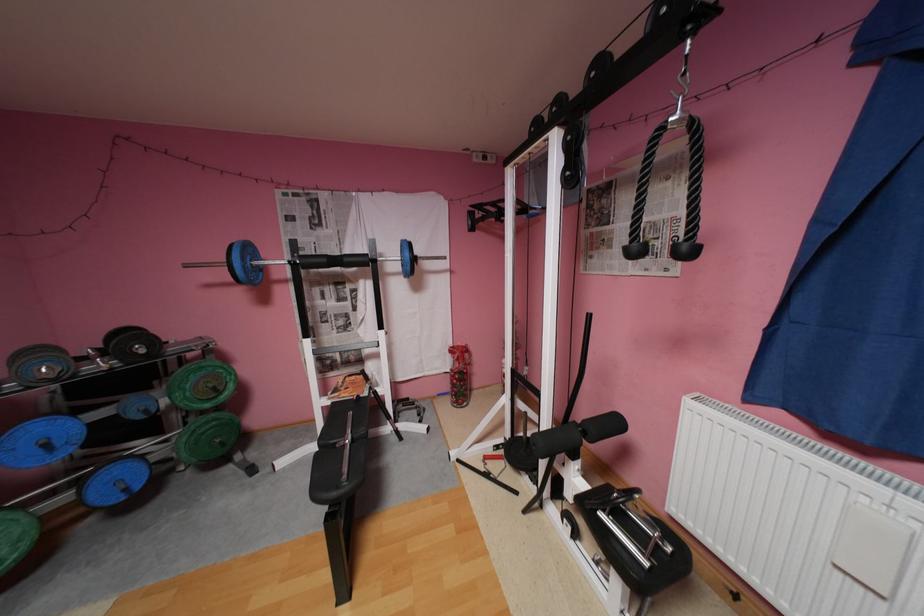
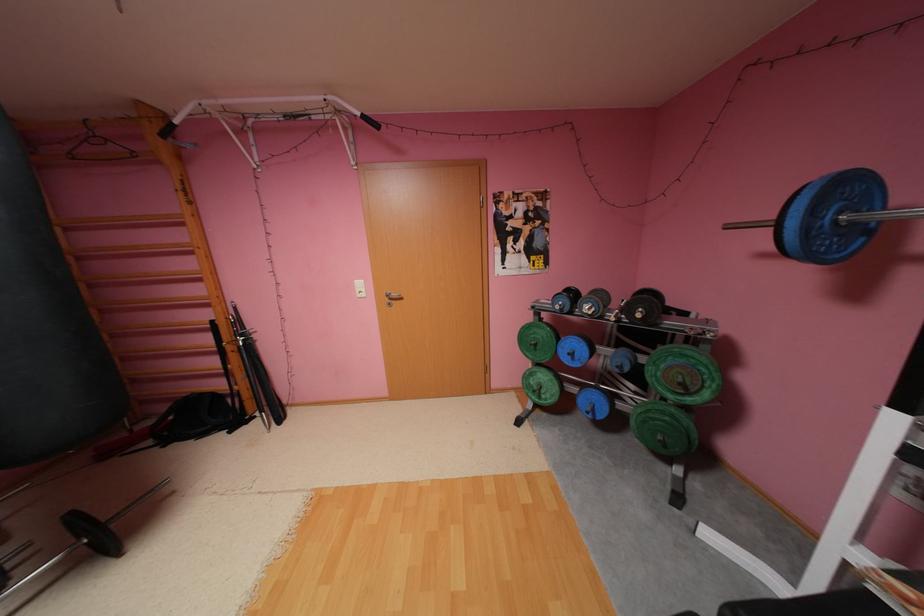
In the second image, find the point that corresponds to point 226,440 in the first image.

(669, 438)